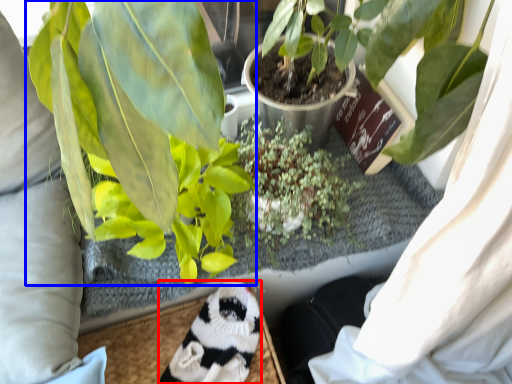
Question: Which point is further to the camera, animal (highlighted by a red box) or houseplant (highlighted by a blue box)?

Choices:
 (A) animal
 (B) houseplant

Answer: (A)